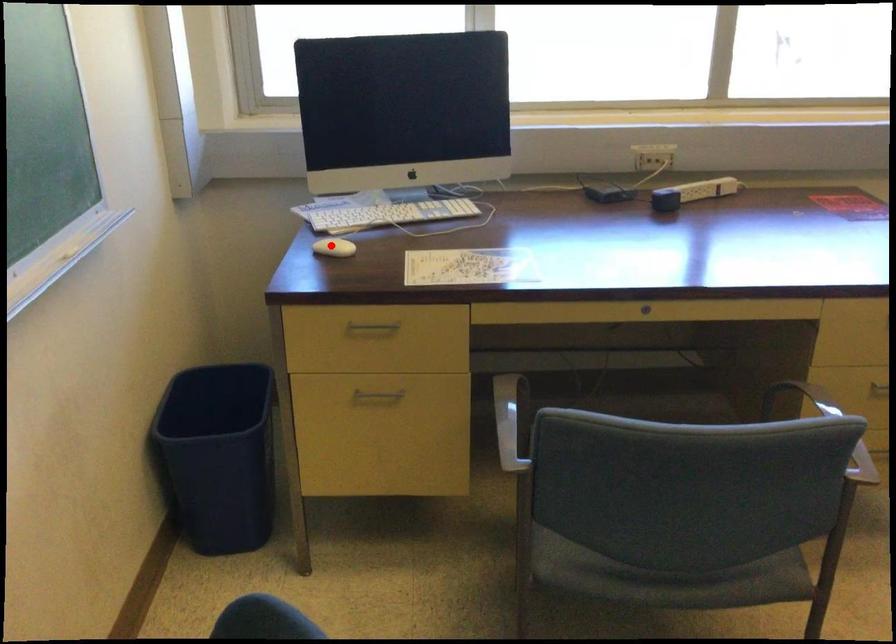
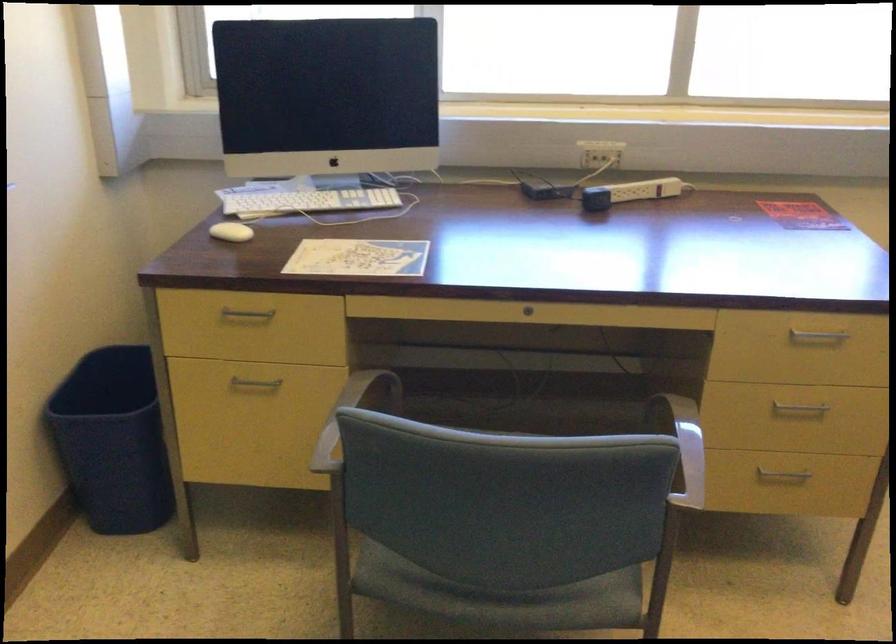
Where in the second image is the point corresponding to the highlighted location from the first image?

(230, 232)